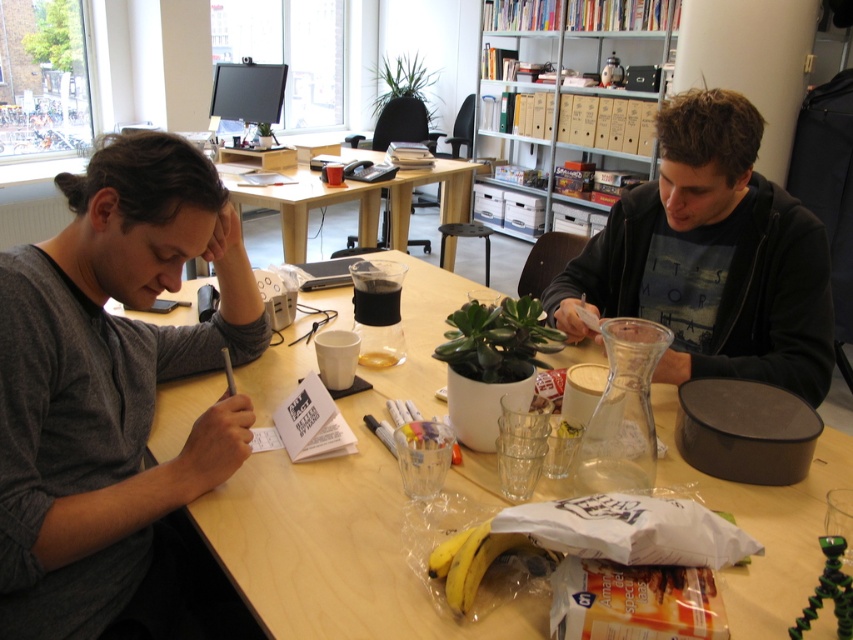
Question: Among these objects, which one is farthest from the camera?

Choices:
 (A) gray cotton shirt at left
 (B) wooden table at center

Answer: (A)

Question: Can you confirm if black matte hoodie at center is positioned to the left of yellow matte bananas at center?

Choices:
 (A) yes
 (B) no

Answer: (B)

Question: Which point appears closest to the camera in this image?

Choices:
 (A) (608, 284)
 (B) (370, 529)
 (C) (480, 573)

Answer: (C)

Question: Is gray cotton shirt at left thinner than yellow matte bananas at center?

Choices:
 (A) yes
 (B) no

Answer: (B)

Question: Which of the following is the closest to the observer?

Choices:
 (A) (489, 522)
 (B) (260, 618)
 (C) (138, 532)
 (D) (302, 232)

Answer: (B)

Question: Can you confirm if black matte hoodie at center is positioned to the right of light wood table at center?

Choices:
 (A) yes
 (B) no

Answer: (A)